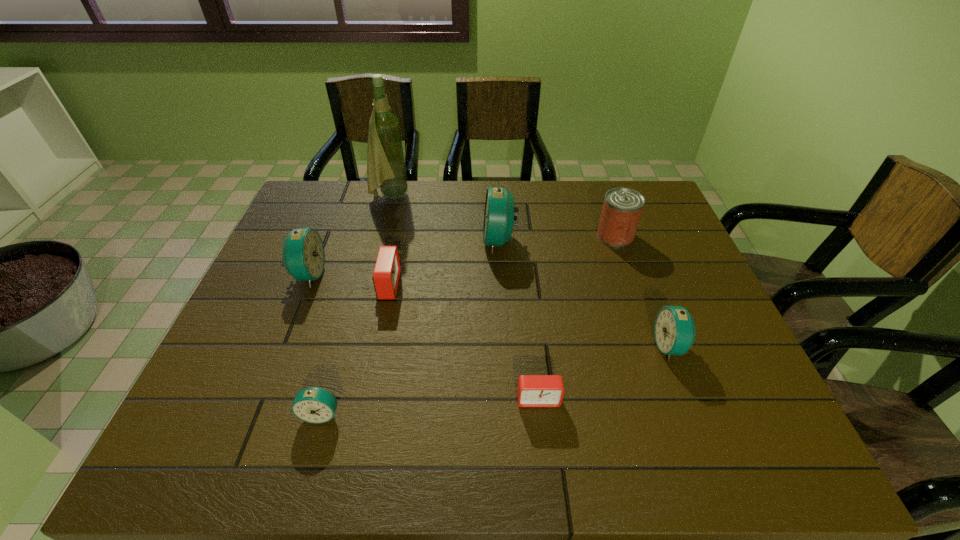
Identify which alarm clock is the fifth nearest to the nearer red alarm clock. Please provide its 2D coordinates. Your answer should be formatted as a tuple, i.e. [(x, y)], where the tuple contains the x and y coordinates of a point satisfying the conditions above.

[(303, 253)]

Locate an element on the screen. This screenshot has height=540, width=960. the second closest blue alarm clock to the leftmost blue alarm clock is located at coordinates (498, 216).

You are a GUI agent. You are given a task and a screenshot of the screen. Output one action in this format:
    pyautogui.click(x=<x>, y=<y>)
    Task: Click on the closest blue alarm clock to the smallest blue alarm clock
    The width and height of the screenshot is (960, 540).
    Given the screenshot: What is the action you would take?
    pyautogui.click(x=303, y=253)

This screenshot has width=960, height=540. I want to click on free space that satisfies the following two spatial constraints: 1. on the front-facing side of the wine bottle; 2. on the front-facing side of the fifth alarm clock from right to left, so pos(333,414).

Where is `vacant area in the image that satisfies the following two spatial constraints: 1. on the front-facing side of the fourth alarm clock from right to left; 2. on the front-facing side of the second alarm clock from left to right`? The height and width of the screenshot is (540, 960). vacant area in the image that satisfies the following two spatial constraints: 1. on the front-facing side of the fourth alarm clock from right to left; 2. on the front-facing side of the second alarm clock from left to right is located at coordinates (361, 414).